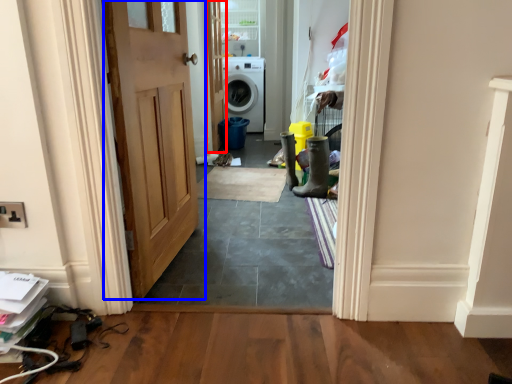
Question: Which object is closer to the camera taking this photo, door (highlighted by a red box) or door (highlighted by a blue box)?

Choices:
 (A) door
 (B) door

Answer: (B)